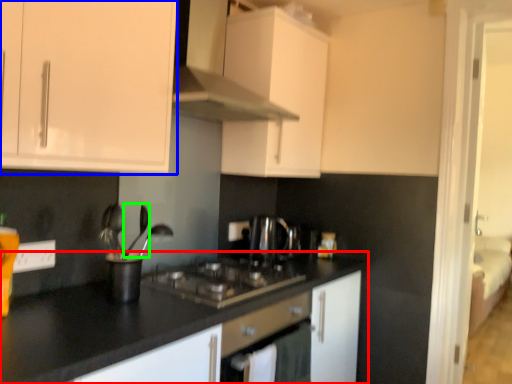
Question: Considering the real-world distances, which object is farthest from countertop (highlighted by a red box)? cabinetry (highlighted by a blue box) or silverware (highlighted by a green box)?

Choices:
 (A) cabinetry
 (B) silverware

Answer: (A)